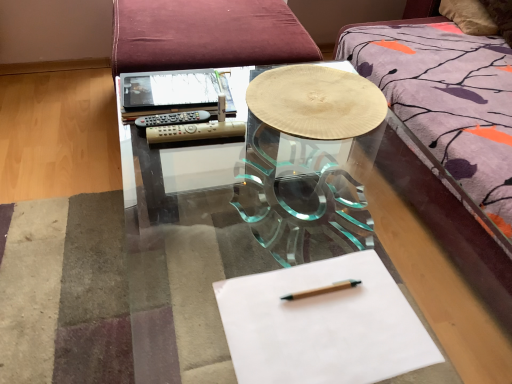
Question: Can you confirm if wooden textured plate at center is thinner than transparent glass table at center?

Choices:
 (A) no
 (B) yes

Answer: (B)

Question: From the image's perspective, is wooden textured plate at center on top of transparent glass table at center?

Choices:
 (A) no
 (B) yes

Answer: (B)

Question: Does wooden textured plate at center turn towards transparent glass table at center?

Choices:
 (A) yes
 (B) no

Answer: (B)

Question: From the image's perspective, is wooden textured plate at center under transparent glass table at center?

Choices:
 (A) no
 (B) yes

Answer: (A)

Question: Considering the relative sizes of wooden textured plate at center and transparent glass table at center in the image provided, is wooden textured plate at center shorter than transparent glass table at center?

Choices:
 (A) no
 (B) yes

Answer: (B)

Question: From a real-world perspective, is wooden textured plate at center over transparent glass table at center?

Choices:
 (A) no
 (B) yes

Answer: (B)

Question: From a real-world perspective, is wooden textured plate at center beneath white paper at center?

Choices:
 (A) yes
 (B) no

Answer: (B)

Question: Is wooden textured plate at center not inside white paper at center?

Choices:
 (A) no
 (B) yes

Answer: (B)

Question: Can you confirm if wooden textured plate at center is bigger than white paper at center?

Choices:
 (A) no
 (B) yes

Answer: (B)

Question: From a real-world perspective, is wooden textured plate at center located higher than white paper at center?

Choices:
 (A) no
 (B) yes

Answer: (B)

Question: Considering the relative sizes of wooden textured plate at center and white paper at center in the image provided, is wooden textured plate at center taller than white paper at center?

Choices:
 (A) no
 (B) yes

Answer: (B)

Question: Can you confirm if wooden textured plate at center is positioned to the right of white paper at center?

Choices:
 (A) no
 (B) yes

Answer: (B)

Question: Is white paper at center further to the viewer compared to wooden textured plate at center?

Choices:
 (A) no
 (B) yes

Answer: (A)